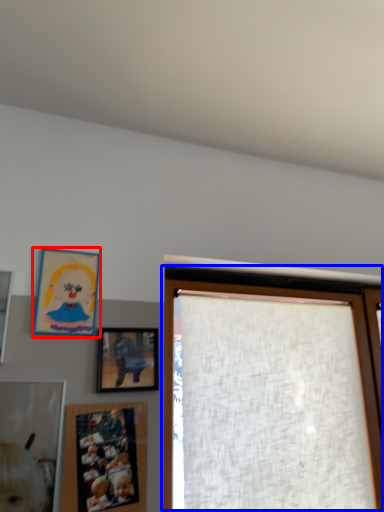
Question: Among these objects, which one is farthest to the camera, picture frame (highlighted by a red box) or window (highlighted by a blue box)?

Choices:
 (A) picture frame
 (B) window

Answer: (B)